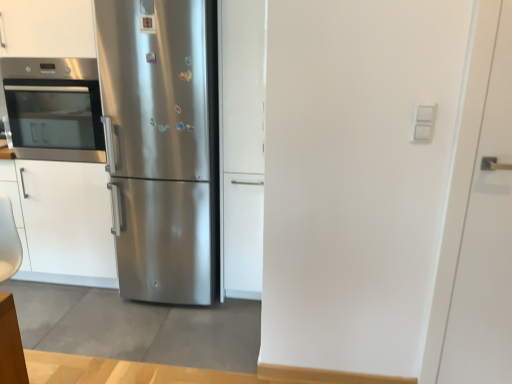
Where is `stainless steel refrigerator at center`? Image resolution: width=512 pixels, height=384 pixels. stainless steel refrigerator at center is located at coordinates (162, 144).

Describe the element at coordinates (486, 240) in the screenshot. The width and height of the screenshot is (512, 384). I see `white matte door at right, arranged as the first door when viewed from the front` at that location.

Locate an element on the screen. This screenshot has height=384, width=512. stainless steel oven at left is located at coordinates (54, 108).

What are the coordinates of `stainless steel refrigerator at center` in the screenshot? It's located at (162, 144).

Considering the sizes of objects white matte door at right, which is the 1th door in right-to-left order, and stainless steel oven at left in the image provided, who is bigger, white matte door at right, which is the 1th door in right-to-left order, or stainless steel oven at left?

Bigger between the two is stainless steel oven at left.

Is stainless steel oven at left at the back of white matte door at right, arranged as the first door when viewed from the front?

No, white matte door at right, arranged as the first door when viewed from the front, is not facing away from stainless steel oven at left.

Is white matte door at right, which is the 1th door in right-to-left order, next to stainless steel oven at left and touching it?

No, white matte door at right, which is the 1th door in right-to-left order, is not next to stainless steel oven at left.

Identify the location of oven above the white matte door at right, which appears as the 2th door when viewed from the back (from a real-world perspective). (54, 108).

Which of these two, satin white cabinet at center, the first door positioned from the back, or white matte door at right, arranged as the first door when viewed from the front, stands shorter?

white matte door at right, arranged as the first door when viewed from the front.

Could you tell me if satin white cabinet at center, marked as the 2th door in a right-to-left arrangement, is facing white matte door at right, which appears as the 2th door when viewed from the back?

No, satin white cabinet at center, marked as the 2th door in a right-to-left arrangement, is not oriented towards white matte door at right, which appears as the 2th door when viewed from the back.

From a real-world perspective, between satin white cabinet at center, the first door positioned from the back, and white matte door at right, arranged as the first door when viewed from the front, who is vertically higher?

satin white cabinet at center, the first door positioned from the back, is physically above.

Between point (228, 62) and point (496, 197), which one is positioned behind?

The point (228, 62) is behind.

Considering the relative positions of white matte door at right, which is the 1th door in right-to-left order, and satin white cabinet at center, marked as the 2th door in a right-to-left arrangement, in the image provided, is white matte door at right, which is the 1th door in right-to-left order, in front of satin white cabinet at center, marked as the 2th door in a right-to-left arrangement,?

Yes, it is in front of satin white cabinet at center, marked as the 2th door in a right-to-left arrangement.

Is satin white cabinet at center, marked as the 2th door in a right-to-left arrangement, at the back of white matte door at right, arranged as the second door when viewed from the left?

No, white matte door at right, arranged as the second door when viewed from the left,'s orientation is not away from satin white cabinet at center, marked as the 2th door in a right-to-left arrangement.

From the image's perspective, is white matte door at right, which is the 1th door in right-to-left order, above or below satin white cabinet at center, which is the 1th door in left-to-right order?

Clearly, from the image's perspective, white matte door at right, which is the 1th door in right-to-left order, is below satin white cabinet at center, which is the 1th door in left-to-right order.

Is white matte door at right, which is the 1th door in right-to-left order, placed right next to satin white cabinet at center, marked as the 2th door in a right-to-left arrangement?

They are not placed beside each other.

Locate an element on the screen. door directly beneath the stainless steel refrigerator at center (from a real-world perspective) is located at coordinates (486, 240).

From the image's perspective, between stainless steel refrigerator at center and white matte door at right, arranged as the first door when viewed from the front, which one is located above?

From the image's view, stainless steel refrigerator at center is above.

Which object is positioned more to the right, stainless steel refrigerator at center or white matte door at right, which is the 1th door in right-to-left order?

white matte door at right, which is the 1th door in right-to-left order, is more to the right.

Does stainless steel refrigerator at center have a larger size compared to satin white cabinet at center, which is the 1th door in left-to-right order?

Yes, stainless steel refrigerator at center is bigger than satin white cabinet at center, which is the 1th door in left-to-right order.

Is stainless steel refrigerator at center taller than satin white cabinet at center, marked as the 2th door in a right-to-left arrangement?

Yes, stainless steel refrigerator at center is taller than satin white cabinet at center, marked as the 2th door in a right-to-left arrangement.

Does stainless steel refrigerator at center appear on the right side of satin white cabinet at center, marked as the 2th door in a right-to-left arrangement?

No, stainless steel refrigerator at center is not to the right of satin white cabinet at center, marked as the 2th door in a right-to-left arrangement.

Considering their positions, is stainless steel refrigerator at center located in front of or behind satin white cabinet at center, the 2th door viewed from the front?

Clearly, stainless steel refrigerator at center is in front of satin white cabinet at center, the 2th door viewed from the front.

Between stainless steel oven at left and stainless steel refrigerator at center, which one has more height?

Standing taller between the two is stainless steel refrigerator at center.

Could you tell me if stainless steel oven at left is facing stainless steel refrigerator at center?

No, stainless steel oven at left is not facing towards stainless steel refrigerator at center.

Between stainless steel oven at left and stainless steel refrigerator at center, which one is positioned behind?

stainless steel oven at left is behind.

Does stainless steel oven at left have a larger size compared to stainless steel refrigerator at center?

No, stainless steel oven at left is not bigger than stainless steel refrigerator at center.

Consider the image. From a real-world perspective, between stainless steel refrigerator at center and stainless steel oven at left, who is vertically lower?

stainless steel refrigerator at center is physically lower.

Is point (216, 9) positioned in front of point (38, 76)?

Yes.

Looking at the image, does stainless steel refrigerator at center seem bigger or smaller compared to stainless steel oven at left?

stainless steel refrigerator at center is bigger than stainless steel oven at left.

Considering the sizes of stainless steel refrigerator at center and stainless steel oven at left in the image, is stainless steel refrigerator at center taller or shorter than stainless steel oven at left?

Clearly, stainless steel refrigerator at center is taller compared to stainless steel oven at left.

Locate an element on the screen. Image resolution: width=512 pixels, height=384 pixels. oven above the white matte door at right, arranged as the first door when viewed from the front (from a real-world perspective) is located at coordinates (54, 108).

Where is `door that appears behind the white matte door at right, which appears as the 2th door when viewed from the back`? door that appears behind the white matte door at right, which appears as the 2th door when viewed from the back is located at coordinates (242, 144).

When comparing their distances from stainless steel refrigerator at center, does satin white cabinet at center, marked as the 2th door in a right-to-left arrangement, or stainless steel oven at left seem further?

Based on the image, stainless steel oven at left appears to be further to stainless steel refrigerator at center.

Looking at this image, estimate the real-world distances between objects in this image. Which object is further from stainless steel oven at left, satin white cabinet at center, the 2th door viewed from the front, or stainless steel refrigerator at center?

The object further to stainless steel oven at left is satin white cabinet at center, the 2th door viewed from the front.

From the image, which object appears to be nearer to satin white cabinet at center, the 2th door viewed from the front, white matte door at right, which appears as the 2th door when viewed from the back, or stainless steel refrigerator at center?

stainless steel refrigerator at center is positioned closer to the anchor satin white cabinet at center, the 2th door viewed from the front.

Considering their positions, is stainless steel oven at left positioned further to satin white cabinet at center, marked as the 2th door in a right-to-left arrangement, than white matte door at right, arranged as the first door when viewed from the front?

Based on the image, white matte door at right, arranged as the first door when viewed from the front, appears to be further to satin white cabinet at center, marked as the 2th door in a right-to-left arrangement.

Considering their positions, is white matte door at right, which appears as the 2th door when viewed from the back, positioned further to stainless steel oven at left than satin white cabinet at center, marked as the 2th door in a right-to-left arrangement?

white matte door at right, which appears as the 2th door when viewed from the back, is positioned further to the anchor stainless steel oven at left.

Consider the image. From the image, which object appears to be nearer to white matte door at right, arranged as the first door when viewed from the front, stainless steel oven at left or satin white cabinet at center, the 2th door viewed from the front?

satin white cabinet at center, the 2th door viewed from the front, is closer to white matte door at right, arranged as the first door when viewed from the front.

From the image, which object appears to be farther from stainless steel refrigerator at center, satin white cabinet at center, the first door positioned from the back, or white matte door at right, arranged as the first door when viewed from the front?

Among the two, white matte door at right, arranged as the first door when viewed from the front, is located further to stainless steel refrigerator at center.

Looking at this image, considering their positions, is stainless steel refrigerator at center positioned closer to white matte door at right, which appears as the 2th door when viewed from the back, than stainless steel oven at left?

stainless steel refrigerator at center is closer to white matte door at right, which appears as the 2th door when viewed from the back.

This screenshot has height=384, width=512. I want to click on refrigerator between stainless steel oven at left and satin white cabinet at center, which is the 1th door in left-to-right order, from left to right, so click(x=162, y=144).

Image resolution: width=512 pixels, height=384 pixels. I want to click on door between stainless steel oven at left and white matte door at right, arranged as the second door when viewed from the left, from left to right, so click(242, 144).

Where is `refrigerator between stainless steel oven at left and white matte door at right, which appears as the 2th door when viewed from the back`? This screenshot has height=384, width=512. refrigerator between stainless steel oven at left and white matte door at right, which appears as the 2th door when viewed from the back is located at coordinates (162, 144).

This screenshot has height=384, width=512. I want to click on door between stainless steel refrigerator at center and white matte door at right, which appears as the 2th door when viewed from the back, so click(x=242, y=144).